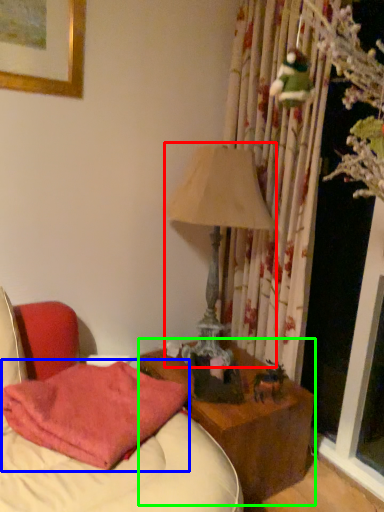
Question: Considering the real-world distances, which object is closest to table lamp (highlighted by a red box)? pillow (highlighted by a blue box) or nightstand (highlighted by a green box).

Choices:
 (A) pillow
 (B) nightstand

Answer: (A)